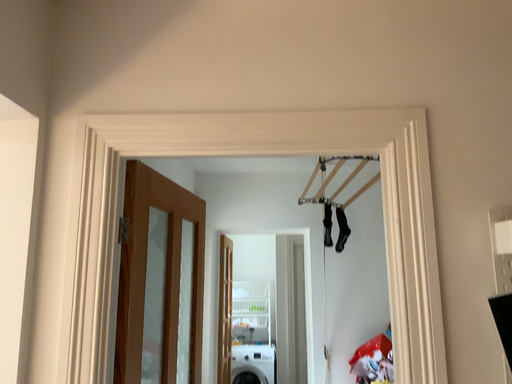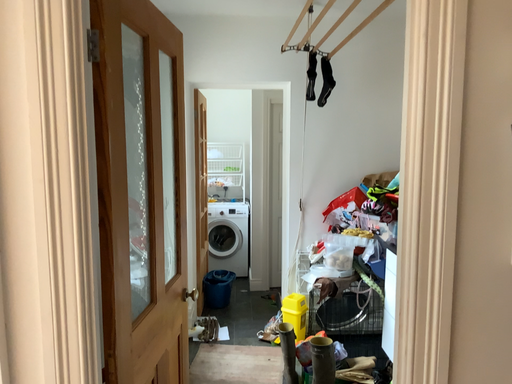
Question: Which way did the camera rotate in the video?

Choices:
 (A) rotated upward
 (B) rotated downward

Answer: (B)